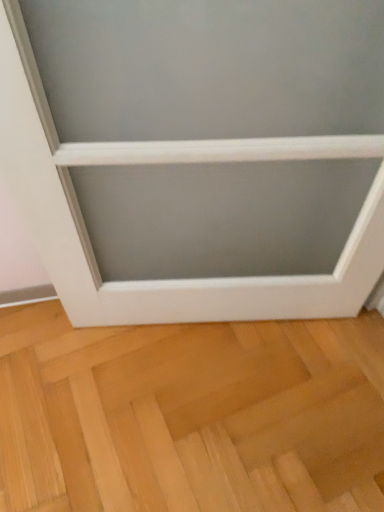
I want to click on white wood door at center, so click(x=190, y=415).

What do you see at coordinates (190, 415) in the screenshot? The image size is (384, 512). I see `white wood door at center` at bounding box center [190, 415].

This screenshot has width=384, height=512. I want to click on white wood door at center, so click(x=190, y=415).